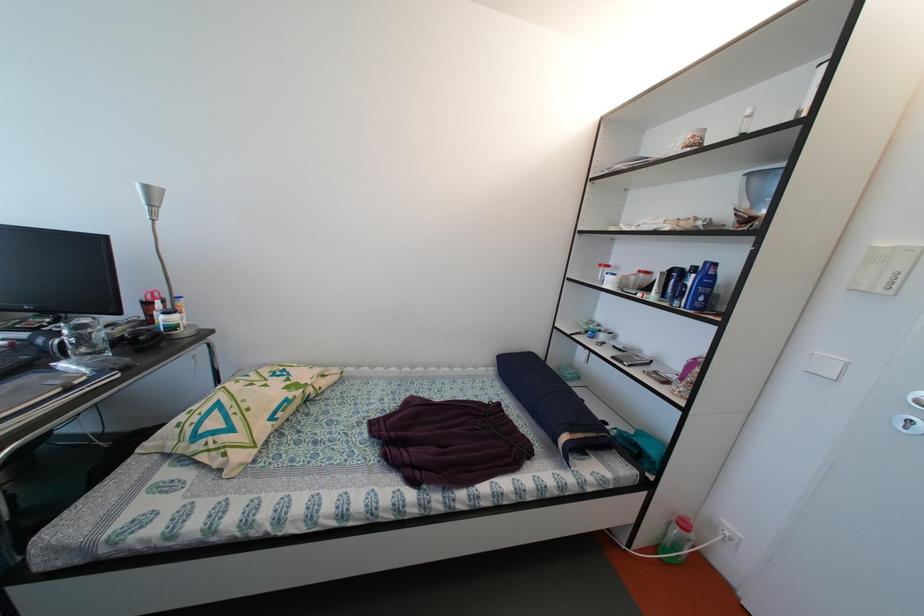
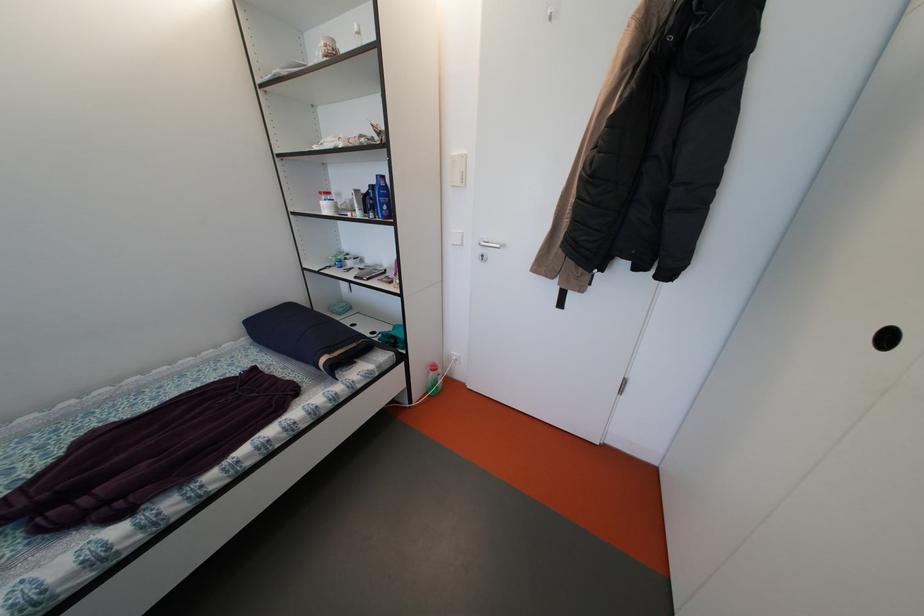
Locate, in the second image, the point that corresponds to (691,530) in the first image.

(441, 373)